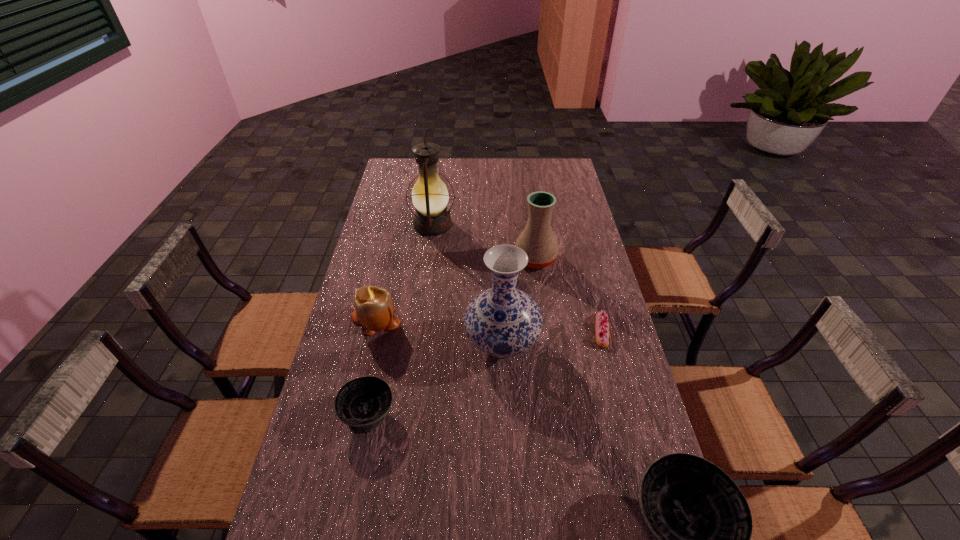
I want to click on free spot between the pottery and the shortest object, so click(x=568, y=295).

This screenshot has width=960, height=540. I want to click on free area in between the second shortest object and the sixth nearest object, so click(x=452, y=336).

Locate an element on the screen. The height and width of the screenshot is (540, 960). vacant region between the candle and the farther bowl is located at coordinates (372, 366).

What are the coordinates of `empty space between the shortest object and the vase` in the screenshot? It's located at (552, 337).

At what (x,y) coordinates should I click in order to perform the action: click on the third closest object relative to the vase. Please return your answer as a coordinate pair (x, y). Image resolution: width=960 pixels, height=540 pixels. Looking at the image, I should click on (537, 239).

Locate an element on the screen. The width and height of the screenshot is (960, 540). object that stands as the third closest to the sixth farthest object is located at coordinates (702, 522).

The height and width of the screenshot is (540, 960). Identify the location of free spot that satisfies the following two spatial constraints: 1. on the back side of the eclair; 2. on the left side of the farther bowl. (385, 330).

Where is `vacant space that satisfies the following two spatial constraints: 1. on the front side of the shortest object; 2. on the left side of the sixth nearest object`? vacant space that satisfies the following two spatial constraints: 1. on the front side of the shortest object; 2. on the left side of the sixth nearest object is located at coordinates [x=545, y=330].

Where is `vacant space that satisfies the following two spatial constraints: 1. on the back side of the oil lamp; 2. on the right side of the shorter bowl`? vacant space that satisfies the following two spatial constraints: 1. on the back side of the oil lamp; 2. on the right side of the shorter bowl is located at coordinates (407, 225).